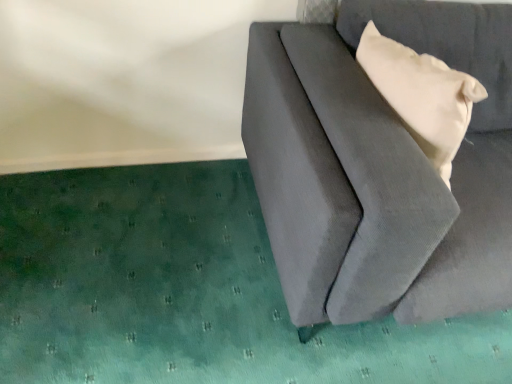
Question: From a real-world perspective, is matte beige pillow at upper right physically above suede gray couch at right?

Choices:
 (A) no
 (B) yes

Answer: (B)

Question: From a real-world perspective, is matte beige pillow at upper right physically below suede gray couch at right?

Choices:
 (A) yes
 (B) no

Answer: (B)

Question: Is matte beige pillow at upper right positioned with its back to suede gray couch at right?

Choices:
 (A) no
 (B) yes

Answer: (B)

Question: Is matte beige pillow at upper right taller than suede gray couch at right?

Choices:
 (A) no
 (B) yes

Answer: (A)

Question: Can you confirm if matte beige pillow at upper right is positioned to the right of suede gray couch at right?

Choices:
 (A) yes
 (B) no

Answer: (B)

Question: Is suede gray couch at right surrounded by matte beige pillow at upper right?

Choices:
 (A) no
 (B) yes

Answer: (A)

Question: Is suede gray couch at right not near matte beige pillow at upper right?

Choices:
 (A) no
 (B) yes

Answer: (A)

Question: From a real-world perspective, is suede gray couch at right positioned under matte beige pillow at upper right based on gravity?

Choices:
 (A) no
 (B) yes

Answer: (B)

Question: Can you confirm if suede gray couch at right is positioned to the left of matte beige pillow at upper right?

Choices:
 (A) no
 (B) yes

Answer: (A)

Question: Does suede gray couch at right have a greater width compared to matte beige pillow at upper right?

Choices:
 (A) no
 (B) yes

Answer: (B)

Question: Does suede gray couch at right touch matte beige pillow at upper right?

Choices:
 (A) no
 (B) yes

Answer: (A)

Question: Would you say suede gray couch at right is outside matte beige pillow at upper right?

Choices:
 (A) yes
 (B) no

Answer: (A)

Question: Is suede gray couch at right wider or thinner than matte beige pillow at upper right?

Choices:
 (A) thin
 (B) wide

Answer: (B)